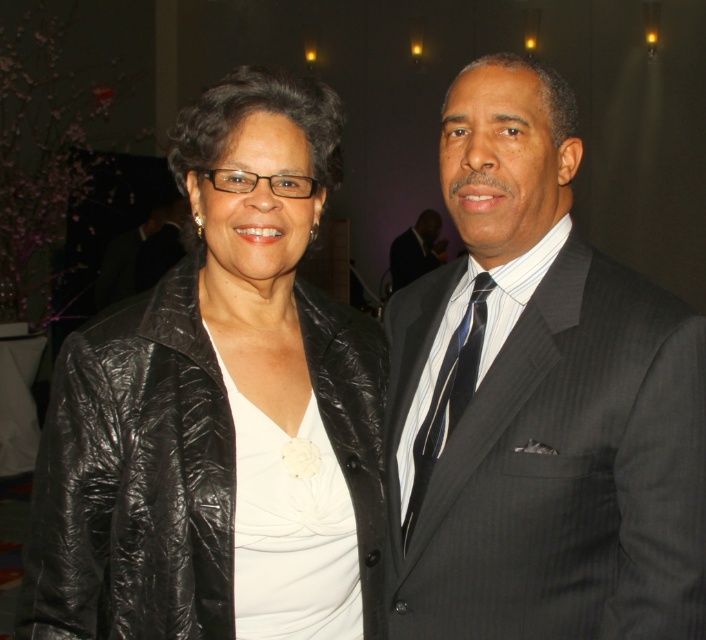
You are a photographer at a formal event. You need to adjust your camera to focus on the striped silk tie at right and the dark suit at center. Since the camera can only focus on objects within 20 feet of each other, will both items be in focus?

The distance between the striped silk tie at right and the dark suit at center is 19.56 feet, which is within the 20 feet range. Therefore, both items will be in focus.